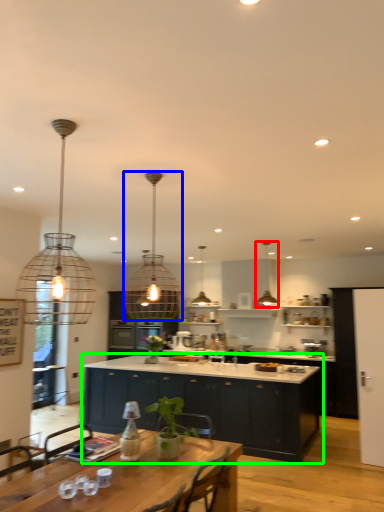
Question: Which object is positioned farthest from lamp (highlighted by a red box)? Select from lamp (highlighted by a blue box) and cabinetry (highlighted by a green box).

Choices:
 (A) lamp
 (B) cabinetry

Answer: (B)